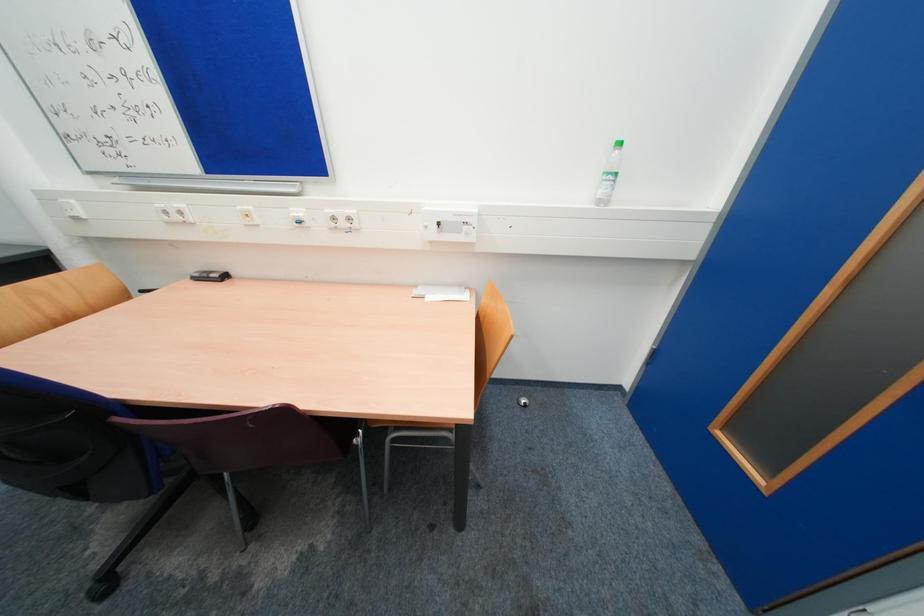
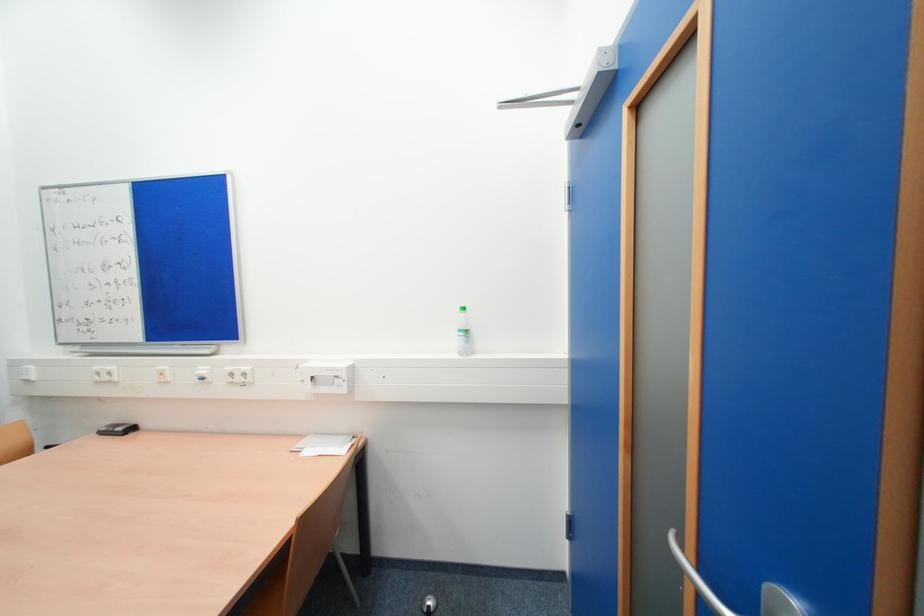
Question: The images are taken continuously from a first-person perspective. In which direction are you moving?

Choices:
 (A) Left
 (B) Right
 (C) Forward
 (D) Backward

Answer: (B)